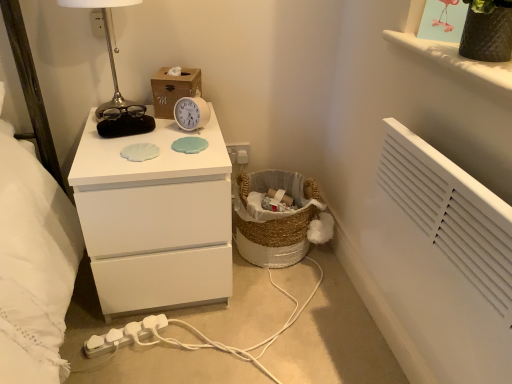
This screenshot has width=512, height=384. I want to click on vacant space that is to the left of white plastic alarm clock at center, so click(145, 138).